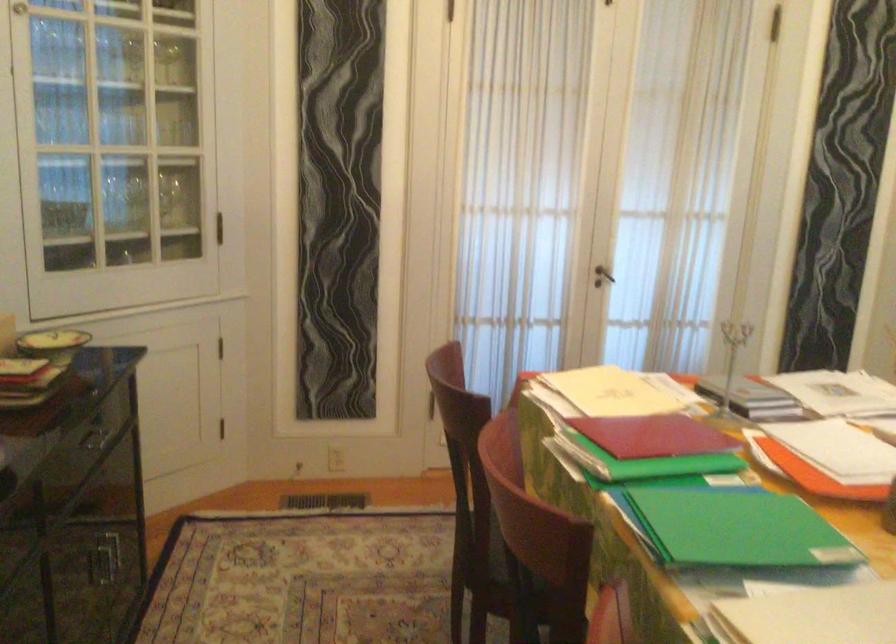
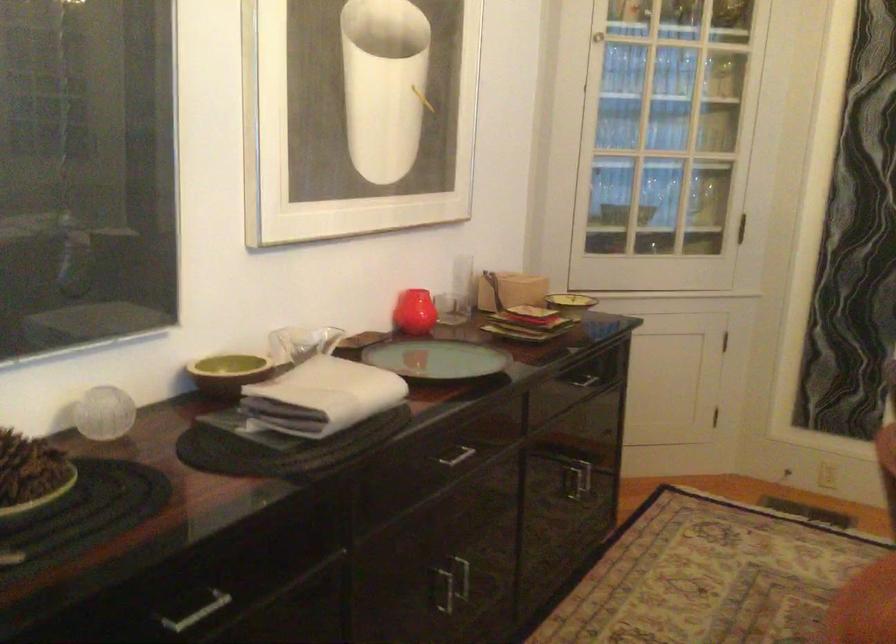
In the second image, find the point that corresponds to [119,564] in the first image.

(574, 483)